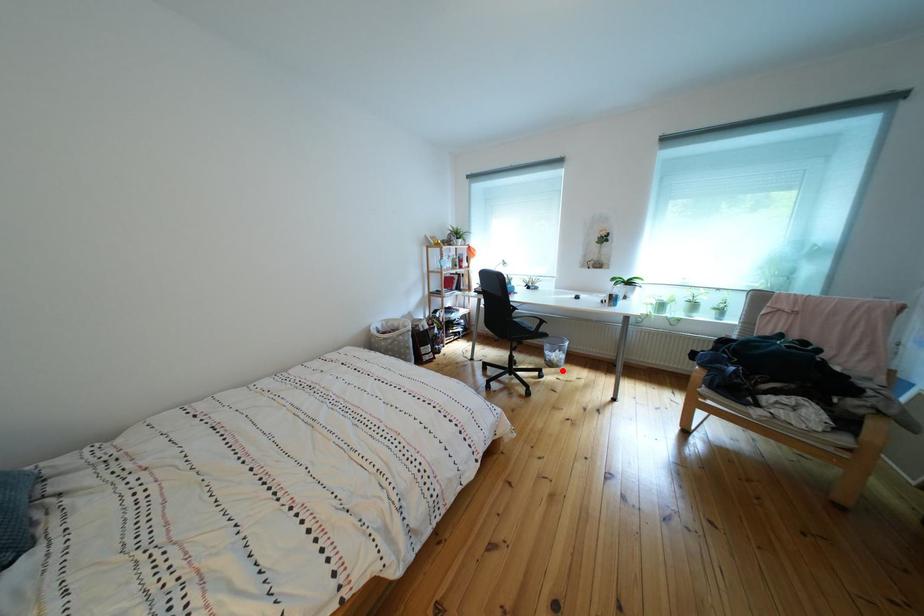
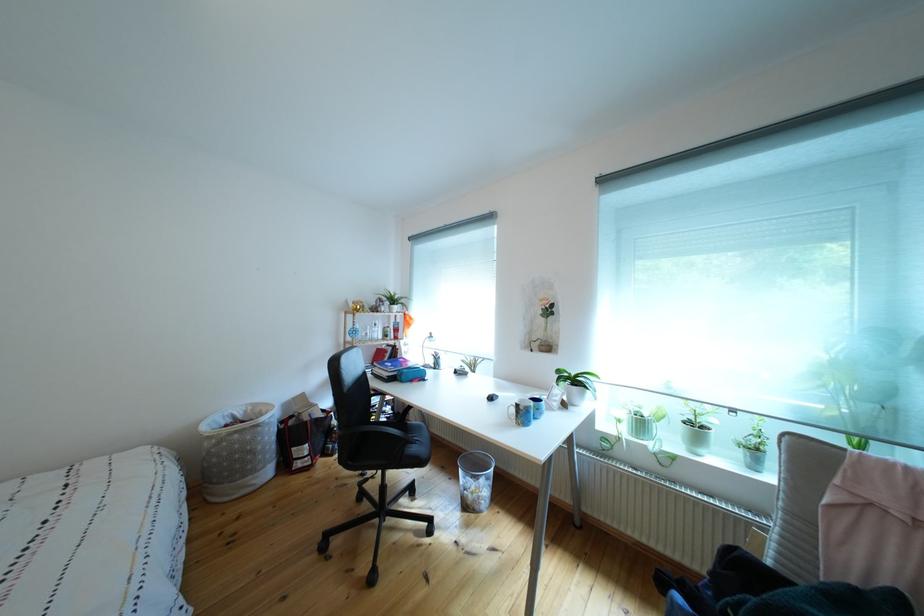
Locate, in the second image, the point that corresponds to the highlighted location in the first image.

(477, 512)